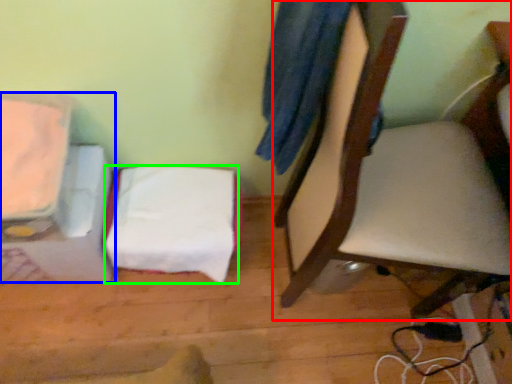
Question: Which is farther away from chair (highlighted by a red box)? furniture (highlighted by a blue box) or sheet (highlighted by a green box)?

Choices:
 (A) furniture
 (B) sheet

Answer: (A)